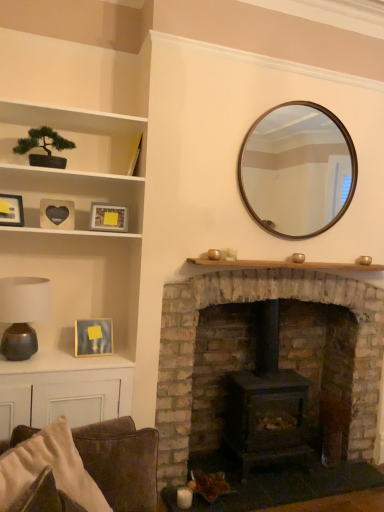
Where is `empty space that is ontop of matte brown table at lower left (from a real-world perspective)`? This screenshot has width=384, height=512. empty space that is ontop of matte brown table at lower left (from a real-world perspective) is located at coordinates (59, 360).